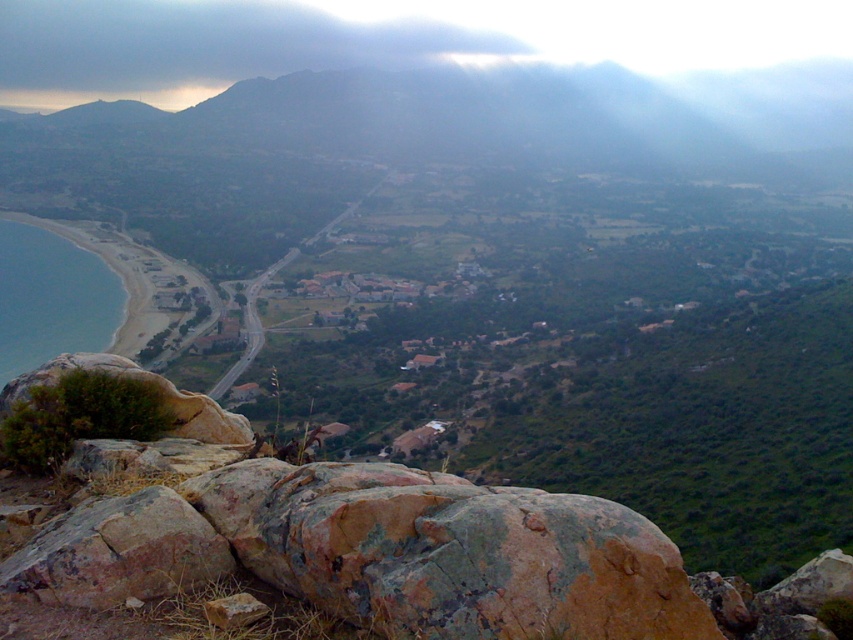
Can you confirm if rusty stone boulder at lower left is shorter than translucent blue water at lower left?

Correct, rusty stone boulder at lower left is not as tall as translucent blue water at lower left.

Looking at this image, which is above, rusty stone boulder at lower left or translucent blue water at lower left?

translucent blue water at lower left is above.

Identify the location of rusty stone boulder at lower left. The image size is (853, 640). (412, 556).